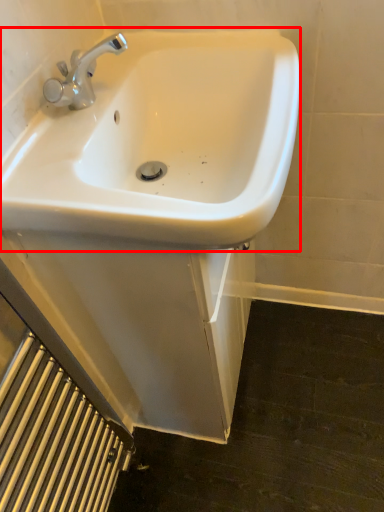
Question: In this image, where is sink (annotated by the red box) located relative to radiator?

Choices:
 (A) right
 (B) left

Answer: (A)